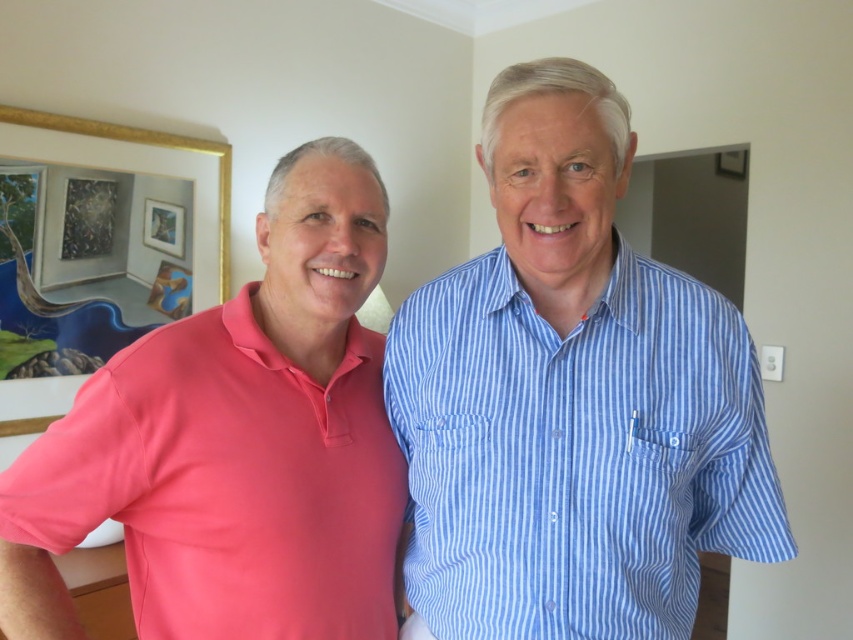
Question: Which object is closer to the camera taking this photo?

Choices:
 (A) wooden picture frame at upper left
 (B) gold framed picture at upper left

Answer: (B)

Question: Is matte pink polo shirt at left above blue striped shirt at center?

Choices:
 (A) no
 (B) yes

Answer: (B)

Question: Is gold framed picture at upper left thinner than wooden picture frame at upper left?

Choices:
 (A) yes
 (B) no

Answer: (B)

Question: Which object is positioned closest to the blue striped shirt at center?

Choices:
 (A) wooden picture frame at upper left
 (B) matte pink polo shirt at left
 (C) gold framed picture at upper left

Answer: (B)

Question: Is matte pink polo shirt at left above wooden picture frame at upper left?

Choices:
 (A) yes
 (B) no

Answer: (B)

Question: Which of the following is the farthest from the observer?

Choices:
 (A) (88, 122)
 (B) (338, 168)

Answer: (A)